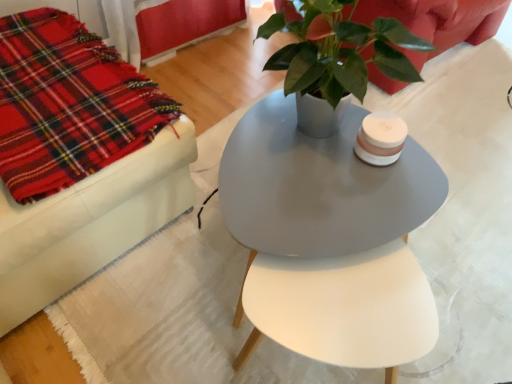
Question: From a real-world perspective, is red plaid fabric at left physically located above or below matte gray table at center?

Choices:
 (A) below
 (B) above

Answer: (B)

Question: Choose the correct answer: Is red plaid fabric at left inside matte gray table at center or outside it?

Choices:
 (A) inside
 (B) outside

Answer: (B)

Question: Which object is positioned closest to the red plaid fabric at left?

Choices:
 (A) matte gray table at center
 (B) matte red couch at upper left

Answer: (A)

Question: Which of these objects is positioned closest to the matte red couch at upper left?

Choices:
 (A) matte gray table at center
 (B) red plaid fabric at left

Answer: (A)